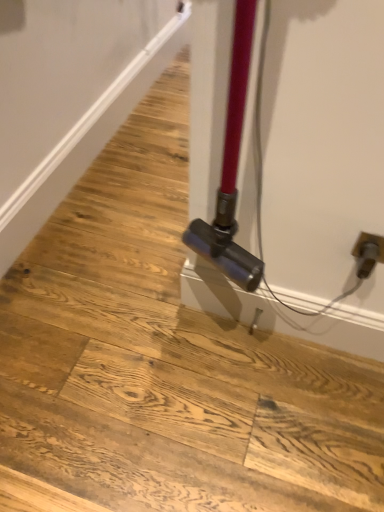
Describe the element at coordinates (368, 253) in the screenshot. The width and height of the screenshot is (384, 512). I see `metallic silver plug at lower right` at that location.

The width and height of the screenshot is (384, 512). Find the location of `metallic silver plug at lower right`. metallic silver plug at lower right is located at coordinates (368, 253).

Identify the location of metallic silver plug at lower right. (368, 253).